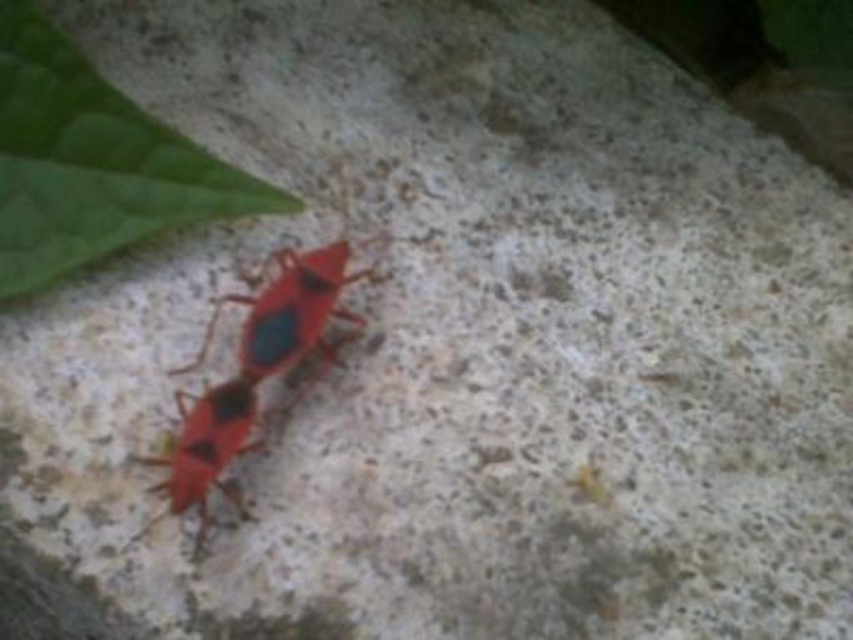
Question: Which object appears closest to the camera in this image?

Choices:
 (A) matte red bug at center
 (B) green matte leaf at upper left

Answer: (A)

Question: Which point is farther to the camera?

Choices:
 (A) green matte leaf at upper left
 (B) matte red bug at center

Answer: (A)

Question: Does green matte leaf at upper left have a lesser width compared to matte red bug at center?

Choices:
 (A) no
 (B) yes

Answer: (A)

Question: Considering the relative positions of green matte leaf at upper left and matte red bug at center in the image provided, where is green matte leaf at upper left located with respect to matte red bug at center?

Choices:
 (A) below
 (B) above

Answer: (B)

Question: Does green matte leaf at upper left appear on the left side of matte red bug at center?

Choices:
 (A) no
 (B) yes

Answer: (B)